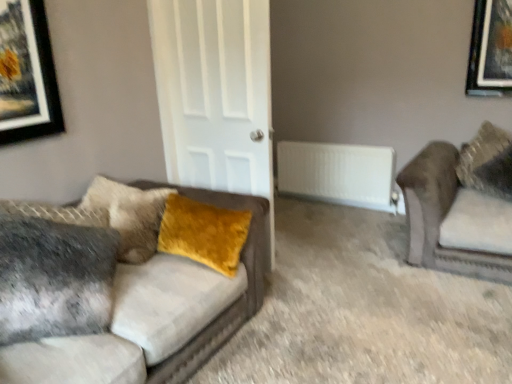
What do you see at coordinates (157, 321) in the screenshot? This screenshot has width=512, height=384. I see `velvet gray couch at left, marked as the 1th studio couch in a left-to-right arrangement` at bounding box center [157, 321].

The image size is (512, 384). Find the location of `velvet yellow pillow at upper right, the 1th pillow viewed from the right`. velvet yellow pillow at upper right, the 1th pillow viewed from the right is located at coordinates (487, 162).

Considering the positions of points (490, 163) and (198, 73), is point (490, 163) farther from camera compared to point (198, 73)?

Yes, point (490, 163) is farther from viewer.

This screenshot has width=512, height=384. Identify the location of pillow that appears on the right of white matte door at center. (487, 162).

Considering the sizes of objects velvet yellow pillow at upper right, the 1th pillow viewed from the right, and velvet gray couch at left, marked as the 1th studio couch in a left-to-right arrangement, in the image provided, who is bigger, velvet yellow pillow at upper right, the 1th pillow viewed from the right, or velvet gray couch at left, marked as the 1th studio couch in a left-to-right arrangement,?

velvet gray couch at left, marked as the 1th studio couch in a left-to-right arrangement.

Which of these two, velvet yellow pillow at upper right, which is the second pillow in front-to-back order, or velvet gray couch at left, marked as the 1th studio couch in a left-to-right arrangement, stands taller?

With more height is velvet yellow pillow at upper right, which is the second pillow in front-to-back order.

Are velvet yellow pillow at upper right, which is the second pillow in front-to-back order, and velvet gray couch at left, marked as the 1th studio couch in a left-to-right arrangement, beside each other?

No, velvet yellow pillow at upper right, which is the second pillow in front-to-back order, is not next to velvet gray couch at left, marked as the 1th studio couch in a left-to-right arrangement.

Can you confirm if velvet yellow pillow at upper right, the 1th pillow when ordered from back to front, is thinner than velvet gray couch at left, the second studio couch when ordered from right to left?

Yes.

Which is more to the left, white matte door at center or white plastic radiator at center?

white matte door at center.

Would you say white matte door at center is outside white plastic radiator at center?

white matte door at center is positioned outside white plastic radiator at center.

Between white matte door at center and white plastic radiator at center, which one has less height?

white plastic radiator at center.

Can you confirm if white matte door at center is thinner than white plastic radiator at center?

Incorrect, the width of white matte door at center is not less than that of white plastic radiator at center.

Is white plastic radiator at center positioned in front of velvet gray couch at left, marked as the 1th studio couch in a left-to-right arrangement?

No, it is not.

Is white plastic radiator at center taller or shorter than velvet gray couch at left, marked as the 1th studio couch in a left-to-right arrangement?

In the image, white plastic radiator at center appears to be shorter than velvet gray couch at left, marked as the 1th studio couch in a left-to-right arrangement.

From a real-world perspective, between white plastic radiator at center and velvet gray couch at left, the second studio couch when ordered from right to left, who is vertically lower?

From a 3D spatial view, white plastic radiator at center is below.

Is velvet brown couch at right, the first studio couch in the right-to-left sequence, wider than velvet gray couch at left, marked as the 1th studio couch in a left-to-right arrangement?

Yes, velvet brown couch at right, the first studio couch in the right-to-left sequence, is wider than velvet gray couch at left, marked as the 1th studio couch in a left-to-right arrangement.

From the picture: Is velvet brown couch at right, the first studio couch in the right-to-left sequence, far from velvet gray couch at left, marked as the 1th studio couch in a left-to-right arrangement?

velvet brown couch at right, the first studio couch in the right-to-left sequence, is positioned a significant distance from velvet gray couch at left, marked as the 1th studio couch in a left-to-right arrangement.

From the image's perspective, between velvet brown couch at right, which is the 2th studio couch from left to right, and velvet gray couch at left, the second studio couch when ordered from right to left, who is located below?

velvet gray couch at left, the second studio couch when ordered from right to left, from the image's perspective.

Image resolution: width=512 pixels, height=384 pixels. Identify the location of studio couch that is under the velvet brown couch at right, the first studio couch in the right-to-left sequence (from a real-world perspective). (157, 321).

Can we say velvet gray couch at left, the second studio couch when ordered from right to left, lies outside white plastic radiator at center?

Indeed, velvet gray couch at left, the second studio couch when ordered from right to left, is completely outside white plastic radiator at center.

Are velvet gray couch at left, marked as the 1th studio couch in a left-to-right arrangement, and white plastic radiator at center located far from each other?

Yes.

Is velvet gray couch at left, the second studio couch when ordered from right to left, looking in the opposite direction of white plastic radiator at center?

No, velvet gray couch at left, the second studio couch when ordered from right to left, is not facing the opposite direction of white plastic radiator at center.

Which is behind, velvet gray couch at left, marked as the 1th studio couch in a left-to-right arrangement, or white plastic radiator at center?

white plastic radiator at center is further away from the camera.

Is white plastic radiator at center at the back of velvet yellow pillow at upper right, which is the second pillow in front-to-back order?

velvet yellow pillow at upper right, which is the second pillow in front-to-back order, does not have its back to white plastic radiator at center.

From the image's perspective, is velvet yellow pillow at upper right, the 1th pillow viewed from the right, on top of white plastic radiator at center?

No, from the image's perspective, velvet yellow pillow at upper right, the 1th pillow viewed from the right, is not above white plastic radiator at center.

Is point (497, 192) closer or farther from the camera than point (342, 183)?

Clearly, point (497, 192) is closer to the camera than point (342, 183).

Locate an element on the screen. This screenshot has height=384, width=512. door that is in front of the velvet yellow pillow at upper right, which is the second pillow in front-to-back order is located at coordinates (216, 95).

Which studio couch is the 2nd one when counting from the left side of the velvet yellow pillow at upper right, which is the second pillow in front-to-back order? Please provide its 2D coordinates.

[(157, 321)]

Estimate the real-world distances between objects in this image. Which object is closer to velvet gray couch at left, marked as the 1th studio couch in a left-to-right arrangement, velvet brown couch at right, the first studio couch in the right-to-left sequence, or velvet mustard pillow at left, the 1th pillow in the front-to-back sequence?

Based on the image, velvet mustard pillow at left, the 1th pillow in the front-to-back sequence, appears to be nearer to velvet gray couch at left, marked as the 1th studio couch in a left-to-right arrangement.

Which object lies further to the anchor point velvet gray couch at left, the second studio couch when ordered from right to left, velvet yellow pillow at upper right, the 1th pillow when ordered from back to front, or white plastic radiator at center?

The object further to velvet gray couch at left, the second studio couch when ordered from right to left, is white plastic radiator at center.

Looking at the image, which one is located closer to velvet mustard pillow at left, the 1th pillow in the front-to-back sequence, velvet brown couch at right, the first studio couch in the right-to-left sequence, or velvet gray couch at left, marked as the 1th studio couch in a left-to-right arrangement?

Among the two, velvet gray couch at left, marked as the 1th studio couch in a left-to-right arrangement, is located nearer to velvet mustard pillow at left, the 1th pillow in the front-to-back sequence.

Consider the image. From the image, which object appears to be farther from velvet brown couch at right, which is the 2th studio couch from left to right, velvet gray couch at left, marked as the 1th studio couch in a left-to-right arrangement, or white matte door at center?

velvet gray couch at left, marked as the 1th studio couch in a left-to-right arrangement, is positioned further to the anchor velvet brown couch at right, which is the 2th studio couch from left to right.

From the picture: When comparing their distances from velvet brown couch at right, which is the 2th studio couch from left to right, does white plastic radiator at center or velvet mustard pillow at left, the second pillow positioned from the right, seem closer?

white plastic radiator at center lies closer to velvet brown couch at right, which is the 2th studio couch from left to right, than the other object.

Which object lies further to the anchor point velvet brown couch at right, which is the 2th studio couch from left to right, velvet gray couch at left, the second studio couch when ordered from right to left, or velvet yellow pillow at upper right, the 1th pillow viewed from the right?

Among the two, velvet gray couch at left, the second studio couch when ordered from right to left, is located further to velvet brown couch at right, which is the 2th studio couch from left to right.

From the image, which object appears to be farther from velvet yellow pillow at upper right, the 1th pillow viewed from the right, velvet mustard pillow at left, the second pillow viewed from the back, or velvet gray couch at left, the second studio couch when ordered from right to left?

velvet mustard pillow at left, the second pillow viewed from the back, is further to velvet yellow pillow at upper right, the 1th pillow viewed from the right.

Based on their spatial positions, is velvet gray couch at left, the second studio couch when ordered from right to left, or velvet yellow pillow at upper right, which is the second pillow in front-to-back order, closer to white plastic radiator at center?

Among the two, velvet yellow pillow at upper right, which is the second pillow in front-to-back order, is located nearer to white plastic radiator at center.

Locate an element on the screen. This screenshot has width=512, height=384. door located between velvet mustard pillow at left, the 1th pillow in the front-to-back sequence, and white plastic radiator at center in the depth direction is located at coordinates (216, 95).

Locate an element on the screen. The height and width of the screenshot is (384, 512). door between velvet gray couch at left, marked as the 1th studio couch in a left-to-right arrangement, and velvet yellow pillow at upper right, the 1th pillow viewed from the right, from left to right is located at coordinates (216, 95).

Locate an element on the screen. This screenshot has width=512, height=384. pillow between velvet gray couch at left, the second studio couch when ordered from right to left, and white matte door at center in the front-back direction is located at coordinates (54, 278).

Locate an element on the screen. The width and height of the screenshot is (512, 384). studio couch located between velvet gray couch at left, the second studio couch when ordered from right to left, and velvet yellow pillow at upper right, the 1th pillow when ordered from back to front, in the left-right direction is located at coordinates (459, 208).